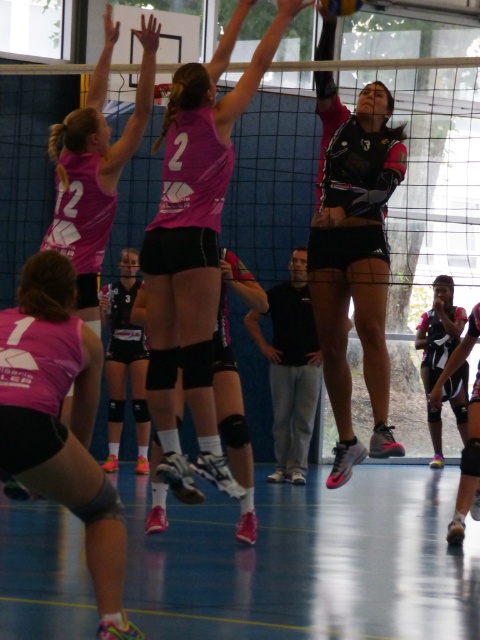
Is pink matte volleyball net at center positioned in front of black matte uniform at center?

No, it is behind black matte uniform at center.

Does pink matte volleyball net at center appear under black matte uniform at center?

Incorrect, pink matte volleyball net at center is not positioned below black matte uniform at center.

This screenshot has height=640, width=480. Identify the location of pink matte volleyball net at center. (194, 250).

Who is positioned more to the right, black mesh net at center or pink matte shorts at lower left?

black mesh net at center

The width and height of the screenshot is (480, 640). In order to click on black mesh net at center in this screenshot , I will do `click(388, 200)`.

What do you see at coordinates (96, 168) in the screenshot? I see `pink matte jersey at upper left` at bounding box center [96, 168].

Between pink matte jersey at upper left and shiny black volleyball at upper center, which one has less height?

shiny black volleyball at upper center is shorter.

Does point (132, 124) come behind point (350, 8)?

That is True.

Where is `pink matte jersey at upper left`? Image resolution: width=480 pixels, height=640 pixels. pink matte jersey at upper left is located at coordinates (96, 168).